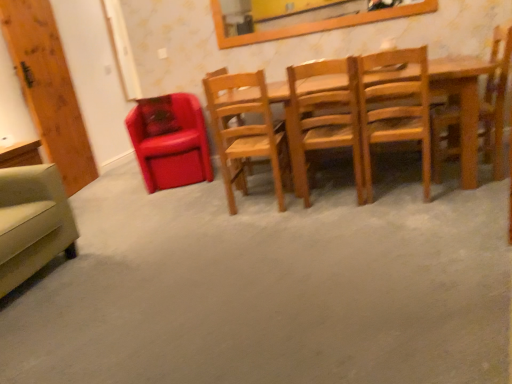
Question: Is beige fabric armchair at lower left, placed as the 6th chair when sorted from right to left, smaller than wooden chair at right, the sixth chair positioned from the left?

Choices:
 (A) no
 (B) yes

Answer: (A)

Question: Does beige fabric armchair at lower left, placed as the 6th chair when sorted from right to left, lie behind wooden chair at right, which is the 1th chair in right-to-left order?

Choices:
 (A) no
 (B) yes

Answer: (A)

Question: Could you tell me if beige fabric armchair at lower left, the 1th chair positioned from the left, is facing wooden chair at right, which is the 1th chair in right-to-left order?

Choices:
 (A) no
 (B) yes

Answer: (A)

Question: Is beige fabric armchair at lower left, placed as the 6th chair when sorted from right to left, turned away from wooden chair at right, the sixth chair positioned from the left?

Choices:
 (A) no
 (B) yes

Answer: (A)

Question: Can you confirm if beige fabric armchair at lower left, the 1th chair positioned from the left, is bigger than wooden chair at right, the sixth chair positioned from the left?

Choices:
 (A) yes
 (B) no

Answer: (A)

Question: Considering the positions of point (50, 258) and point (181, 99), is point (50, 258) closer or farther from the camera than point (181, 99)?

Choices:
 (A) closer
 (B) farther

Answer: (A)

Question: In the image, is beige fabric armchair at lower left, placed as the 6th chair when sorted from right to left, on the left side or the right side of matte leather chair at left, marked as the second chair in a left-to-right arrangement?

Choices:
 (A) right
 (B) left

Answer: (B)

Question: Is beige fabric armchair at lower left, placed as the 6th chair when sorted from right to left, in front of or behind matte leather chair at left, marked as the second chair in a left-to-right arrangement, in the image?

Choices:
 (A) front
 (B) behind

Answer: (A)

Question: In terms of height, does beige fabric armchair at lower left, placed as the 6th chair when sorted from right to left, look taller or shorter compared to matte leather chair at left, the 5th chair viewed from the right?

Choices:
 (A) tall
 (B) short

Answer: (B)

Question: Considering the positions of point (309, 62) and point (73, 241), is point (309, 62) closer or farther from the camera than point (73, 241)?

Choices:
 (A) closer
 (B) farther

Answer: (A)

Question: Considering the positions of wooden chair at center, which is the fourth chair from left to right, and beige fabric armchair at lower left, the 1th chair positioned from the left, in the image, is wooden chair at center, which is the fourth chair from left to right, taller or shorter than beige fabric armchair at lower left, the 1th chair positioned from the left,?

Choices:
 (A) short
 (B) tall

Answer: (B)

Question: Relative to beige fabric armchair at lower left, the 1th chair positioned from the left, is wooden chair at center, which is the fourth chair from left to right, in front or behind?

Choices:
 (A) front
 (B) behind

Answer: (B)

Question: Based on their sizes in the image, would you say wooden chair at center, which is the fourth chair from left to right, is bigger or smaller than beige fabric armchair at lower left, placed as the 6th chair when sorted from right to left?

Choices:
 (A) small
 (B) big

Answer: (A)

Question: From the image's perspective, is wooden frame at upper center positioned above or below wooden chair at center, arranged as the third chair when viewed from the left?

Choices:
 (A) below
 (B) above

Answer: (B)

Question: Is wooden frame at upper center wider or thinner than wooden chair at center, marked as the fourth chair in a right-to-left arrangement?

Choices:
 (A) thin
 (B) wide

Answer: (A)